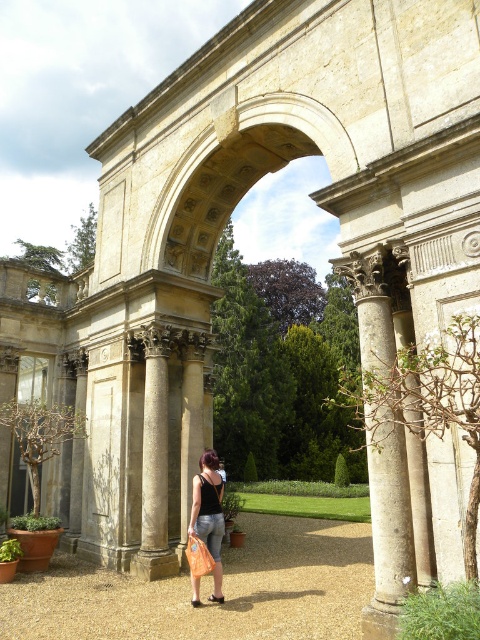
Measure the distance between stone textured archway at center and camera.

A distance of 21.26 meters exists between stone textured archway at center and camera.

Find the location of a particular element. This screenshot has width=480, height=640. stone textured archway at center is located at coordinates (237, 172).

From the picture: Who is more distant from viewer, (352,168) or (205,488)?

The point (205,488) is behind.

This screenshot has width=480, height=640. I want to click on stone textured archway at center, so click(x=237, y=172).

Is smooth stone column at center above black denim jeans at center?

Yes, smooth stone column at center is above black denim jeans at center.

What do you see at coordinates (155, 461) in the screenshot?
I see `smooth stone column at center` at bounding box center [155, 461].

Is point (156, 536) more distant than point (210, 525)?

Yes, point (156, 536) is behind point (210, 525).

At what (x,y) coordinates should I click in order to perform the action: click on smooth stone column at center. Please return your answer as a coordinate pair (x, y). This screenshot has width=480, height=640. Looking at the image, I should click on (155, 461).

This screenshot has width=480, height=640. I want to click on gravel path at center, so click(208, 589).